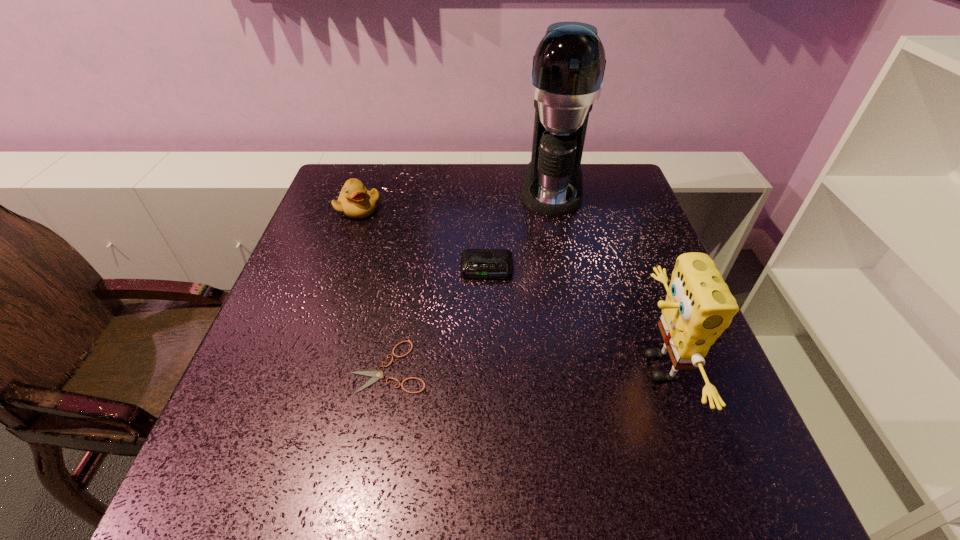
Where is `free space between the tallest object and the fourth shortest object`? This screenshot has height=540, width=960. free space between the tallest object and the fourth shortest object is located at coordinates (605, 278).

At what (x,y) coordinates should I click in order to perform the action: click on unoccupied position between the coffee maker and the third object from left to right. Please return your answer as a coordinate pair (x, y). This screenshot has height=540, width=960. Looking at the image, I should click on (519, 228).

Locate an element on the screen. The width and height of the screenshot is (960, 540). blank region between the fourth object from right to left and the sponge is located at coordinates pyautogui.click(x=523, y=367).

Identify the location of vacant space that is in between the tallest object and the sponge. (605, 278).

This screenshot has width=960, height=540. Identify the location of object that stands as the closest to the third object from left to right. (568, 68).

Locate an element on the screen. The width and height of the screenshot is (960, 540). object that is the third closest one to the third shortest object is located at coordinates (376, 375).

Find the location of a particular element. The width and height of the screenshot is (960, 540). vacant space that satisfies the following two spatial constraints: 1. on the front side of the leftmost object; 2. on the face of the second tallest object is located at coordinates (305, 367).

Locate an element on the screen. The width and height of the screenshot is (960, 540). blank area in the image that satisfies the following two spatial constraints: 1. on the front side of the fourth shortest object; 2. on the face of the fourth tallest object is located at coordinates (489, 367).